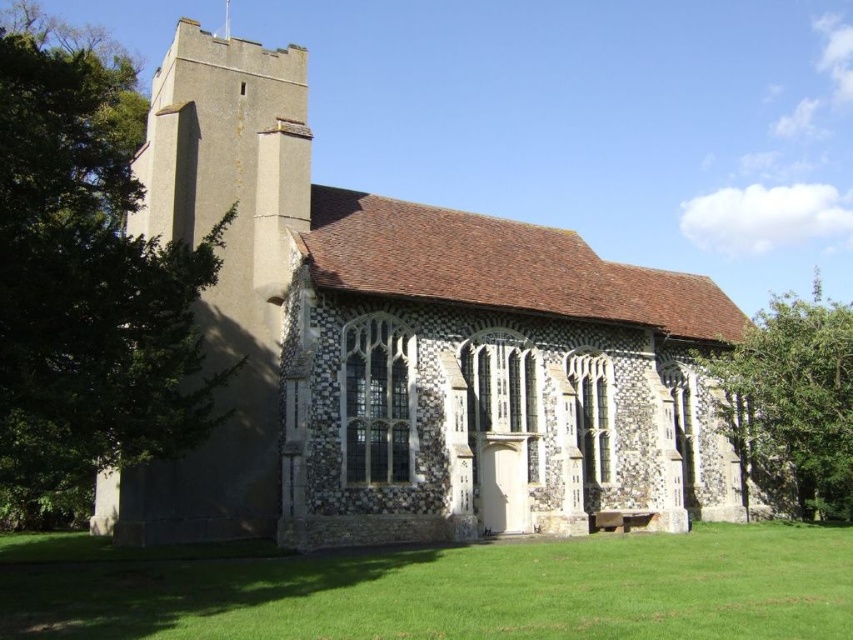
Question: Can you confirm if stone church at center is smaller than green leafy tree at right?

Choices:
 (A) no
 (B) yes

Answer: (B)

Question: Which object is positioned farthest from the green leafy tree at right?

Choices:
 (A) stone church at center
 (B) green leafy tree at left
 (C) green grass at lower center

Answer: (B)

Question: Which object is farther from the camera taking this photo?

Choices:
 (A) stone church at center
 (B) green leafy tree at right

Answer: (B)

Question: Is green grass at lower center smaller than green leafy tree at right?

Choices:
 (A) yes
 (B) no

Answer: (A)

Question: Is the position of green grass at lower center more distant than that of green leafy tree at right?

Choices:
 (A) no
 (B) yes

Answer: (A)

Question: Considering the real-world distances, which object is farthest from the green leafy tree at left?

Choices:
 (A) stone church at center
 (B) green grass at lower center

Answer: (B)